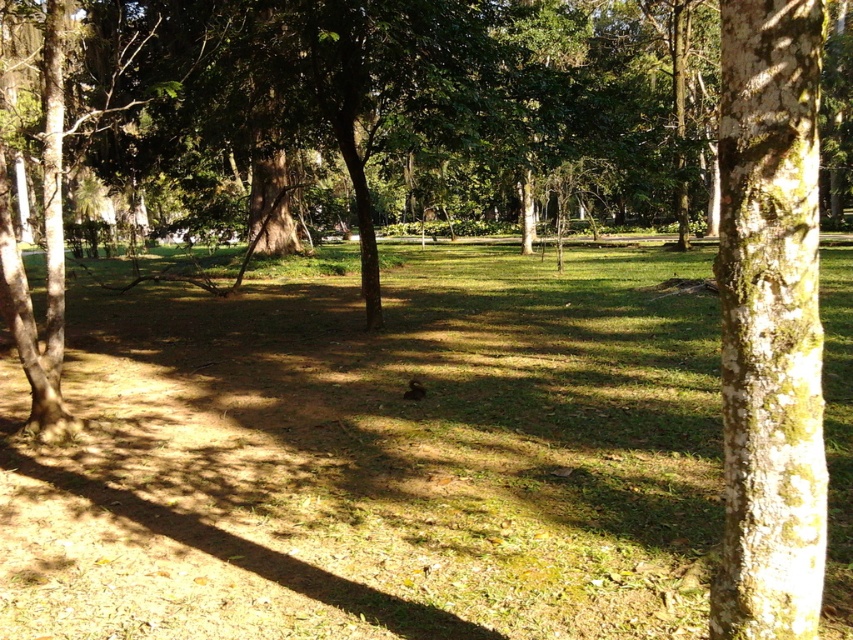
You are a gardener planning to mow the lawn in the park. You have a lawnmower that can only handle areas larger than the green mossy bark tree trunk at right. Based on the scene, will the green grassy at center be suitable for mowing with your lawnmower?

The green grassy at center has a larger size compared to the green mossy bark tree trunk at right, so yes, the lawnmower can handle the green grassy at center since it is larger than the tree trunk.